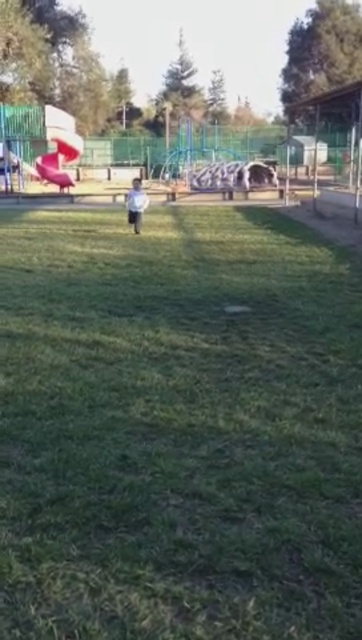
You are standing at the edge of the playground and see the green grassy field at center and the white matte shirt at center. Which object is closer to you?

The green grassy field at center is closer to the viewer than the white matte shirt at center.

You are standing at the playground entrance and want to reach the green grassy field at center. According to the coordinates provided, in which direction should you walk from your current position?

The green grassy field at center is located at coordinates point (178, 428). Since the playground entrance is typically at the edge of the field, you should walk towards the center of the playground to reach the green grassy field at center.

From the picture: You are a parent trying to decide where to place a picnic blanket for your child. The green grassy field at center and the smooth plastic slide at upper left are both options. Which location has a wider area to spread out?

The green grassy field at center has a larger width than the smooth plastic slide at upper left, so it offers a wider area to spread out the picnic blanket.